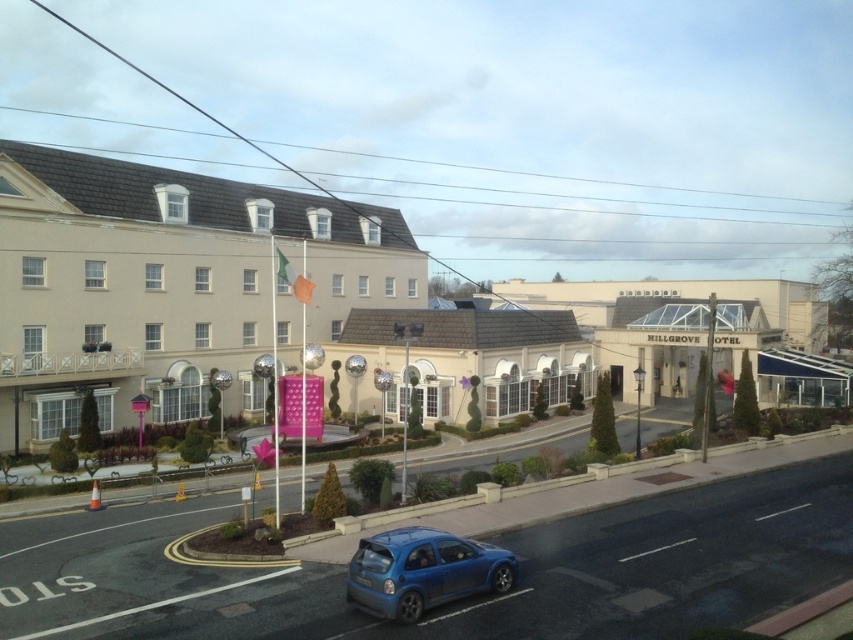
You are a delivery driver approaching the beige stone building at upper left and the metallic blue hatchback at lower center. Since you need to park your vehicle, which object should you avoid driving into because of its height?

You should avoid driving into the beige stone building at upper left because it is much taller than the metallic blue hatchback at lower center, making it an immovable structure that could cause damage.

You are a delivery driver approaching the beige stone building at upper left and the metallic blue hatchback at lower center. Which object is bigger in the image?

The beige stone building at upper left is larger in size compared to the metallic blue hatchback at lower center.

You are a delivery driver approaching the beige stone building at upper left and the metallic blue hatchback at lower center. Which object is closer to the left side of the road?

The beige stone building at upper left is positioned on the left side of the metallic blue hatchback at lower center, so it is closer to the left side of the road.